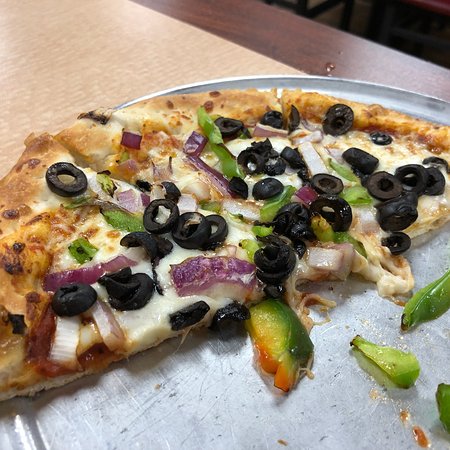
The image size is (450, 450). I want to click on tray, so click(x=163, y=401).